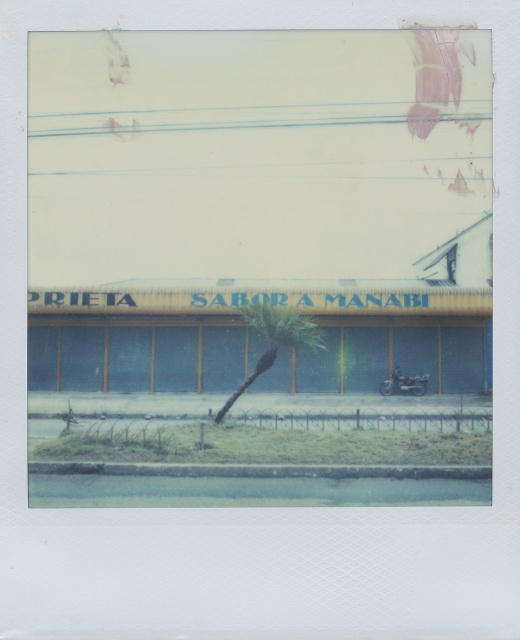
Can you confirm if green leafy tree at center is positioned to the left of shiny black motorcycle at center?

Indeed, green leafy tree at center is positioned on the left side of shiny black motorcycle at center.

Is green leafy tree at center in front of shiny black motorcycle at center?

That is True.

Measure the distance between green leafy tree at center and camera.

green leafy tree at center and camera are 4.46 meters apart.

Find the location of a particular element. This screenshot has height=640, width=520. green leafy tree at center is located at coordinates (274, 340).